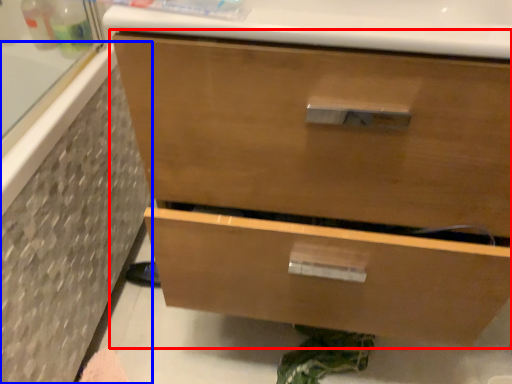
Question: Which object is further to the camera taking this photo, chest of drawers (highlighted by a red box) or bath (highlighted by a blue box)?

Choices:
 (A) chest of drawers
 (B) bath

Answer: (B)